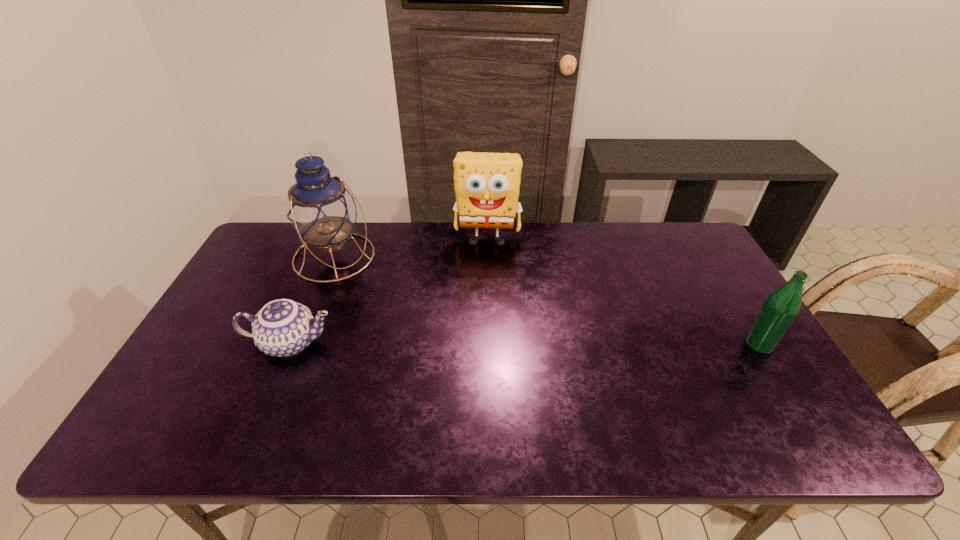
Where is `free space on the desktop that is between the chinaware and the bottle and is positioned on the face of the sponge`? The image size is (960, 540). free space on the desktop that is between the chinaware and the bottle and is positioned on the face of the sponge is located at coordinates (482, 343).

The width and height of the screenshot is (960, 540). I want to click on vacant space on the desktop that is between the shortest object and the rightmost object and is positioned on the front-facing side of the lantern, so click(459, 343).